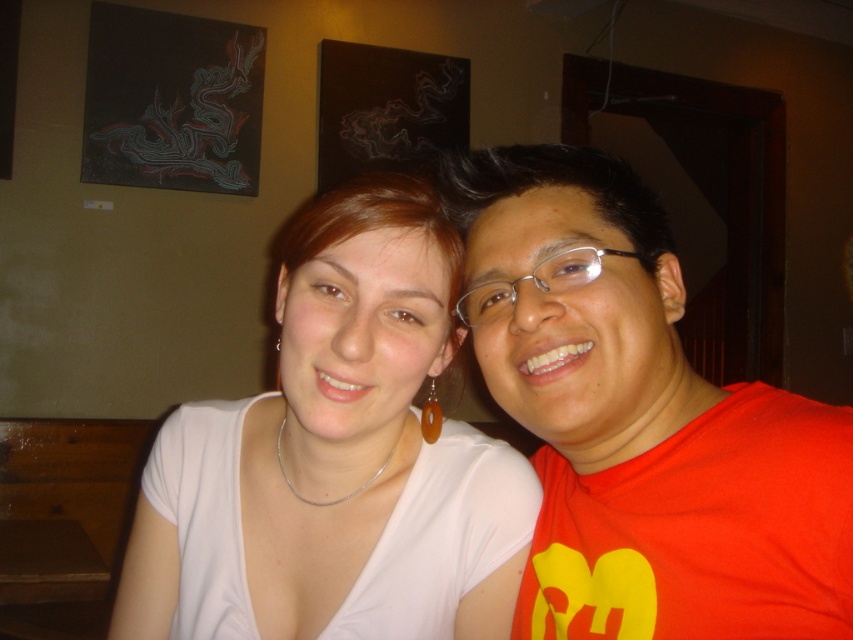
You are a photographer setting up for a portrait. You need to ensure that the white matte shirt at center and the clear plastic glasses at center are both visible in the frame. Based on their positions, which object should you focus on to make sure both are in focus?

The white matte shirt at center is in front of the clear plastic glasses at center. To ensure both are in focus, you should focus on the clear plastic glasses at center since it is farther back, allowing the depth of field to cover both objects.